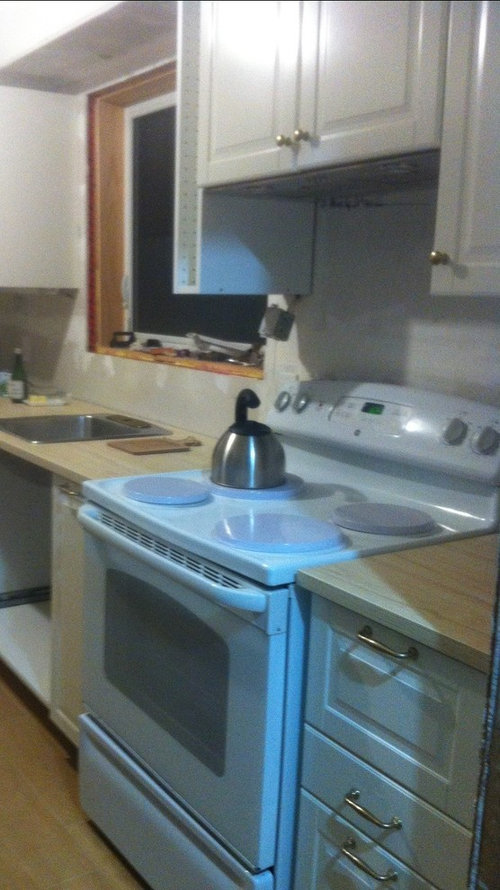
Identify the location of floor. (34, 788).